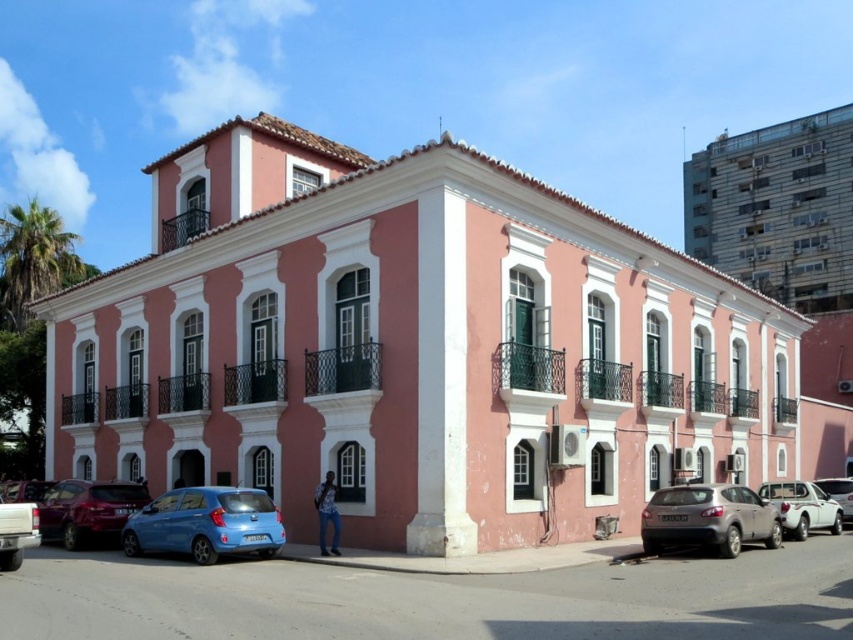
Question: Does white matte car at lower right have a lesser width compared to white matte truck at lower left?

Choices:
 (A) yes
 (B) no

Answer: (B)

Question: Does satin silver suv at lower right have a smaller size compared to white matte car at lower right?

Choices:
 (A) yes
 (B) no

Answer: (B)

Question: Which of these objects is positioned closest to the white glossy sedan at center?

Choices:
 (A) matte blue hatchback at lower left
 (B) white matte car at lower right
 (C) white matte truck at lower left
 (D) shiny red car at lower left

Answer: (B)

Question: Which point appears closest to the camera in this image?

Choices:
 (A) (13, 506)
 (B) (247, 544)
 (C) (85, 540)

Answer: (A)

Question: Among these points, which one is farthest from the camera?

Choices:
 (A) (767, 486)
 (B) (844, 506)

Answer: (B)

Question: Can you confirm if satin silver suv at lower right is positioned to the right of white matte car at lower right?

Choices:
 (A) no
 (B) yes

Answer: (A)